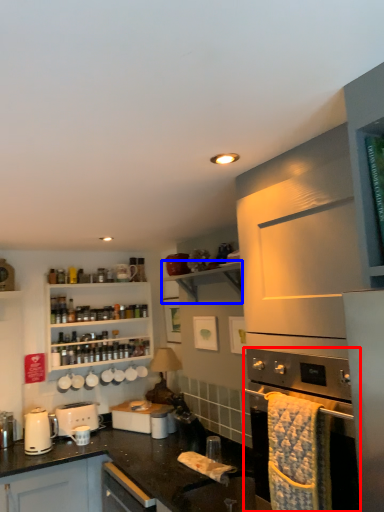
Question: Which object is closer to the camera taking this photo, home appliance (highlighted by a red box) or shelf (highlighted by a blue box)?

Choices:
 (A) home appliance
 (B) shelf

Answer: (A)